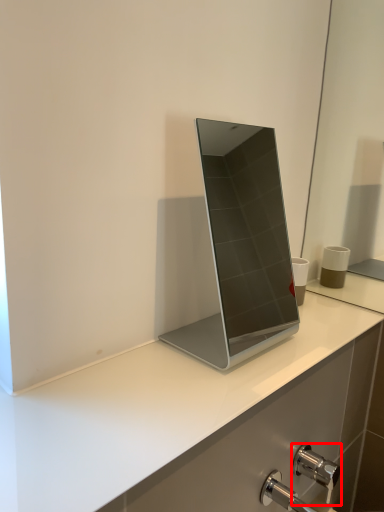
Question: From the image's perspective, considering the relative positions of tap (annotated by the red box) and laptop in the image provided, where is tap (annotated by the red box) located with respect to the staircase?

Choices:
 (A) below
 (B) above

Answer: (A)